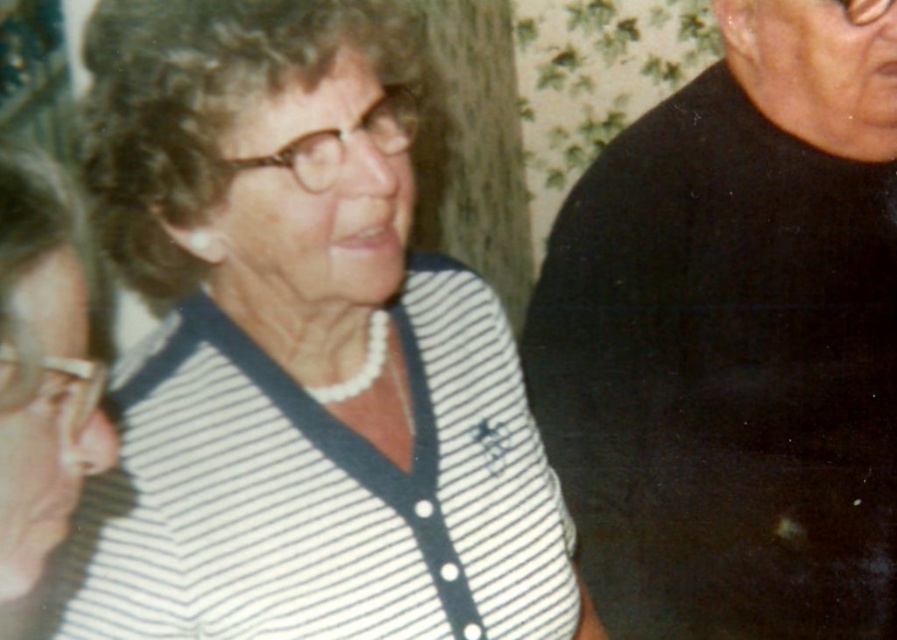
Question: Among these objects, which one is farthest from the camera?

Choices:
 (A) matte black shirt at upper right
 (B) white striped sweater at center

Answer: (B)

Question: Which object is farther from the camera taking this photo?

Choices:
 (A) white striped sweater at center
 (B) black matte shirt at right
 (C) matte black shirt at upper right

Answer: (B)

Question: Is the position of black matte shirt at right more distant than that of matte black shirt at upper right?

Choices:
 (A) no
 (B) yes

Answer: (B)

Question: Is black matte shirt at right positioned in front of white striped sweater at center?

Choices:
 (A) no
 (B) yes

Answer: (A)

Question: Which of the following is the closest to the observer?

Choices:
 (A) matte black shirt at upper right
 (B) black matte shirt at right
 (C) white striped sweater at center

Answer: (A)

Question: Is black matte shirt at right above white striped sweater at center?

Choices:
 (A) yes
 (B) no

Answer: (A)